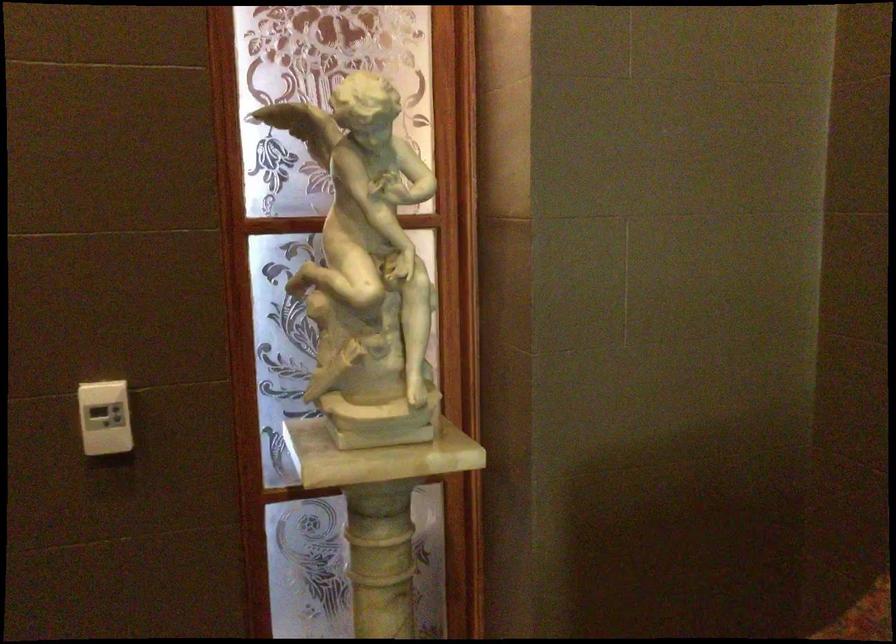
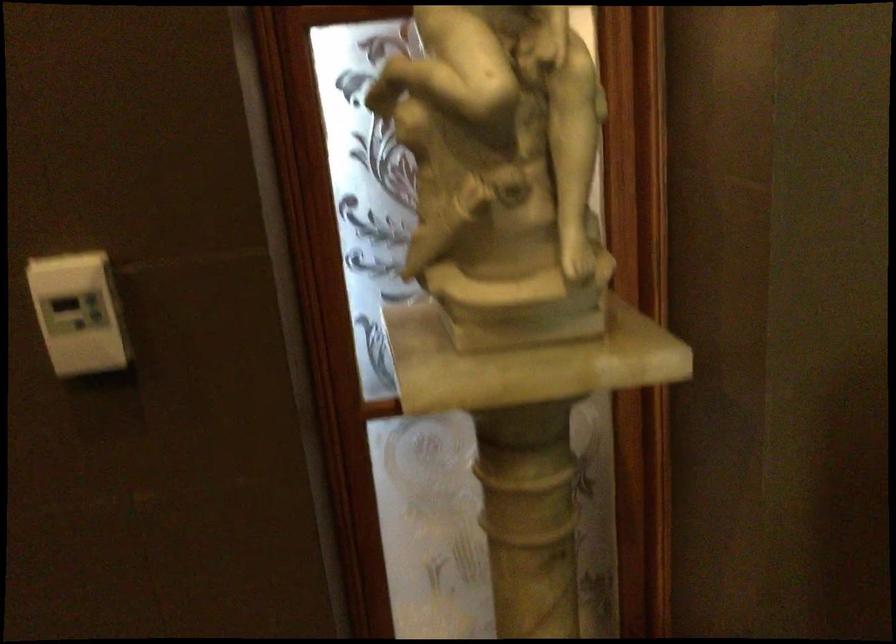
The point at [99,418] is marked in the first image. Where is the corresponding point in the second image?

(79, 313)